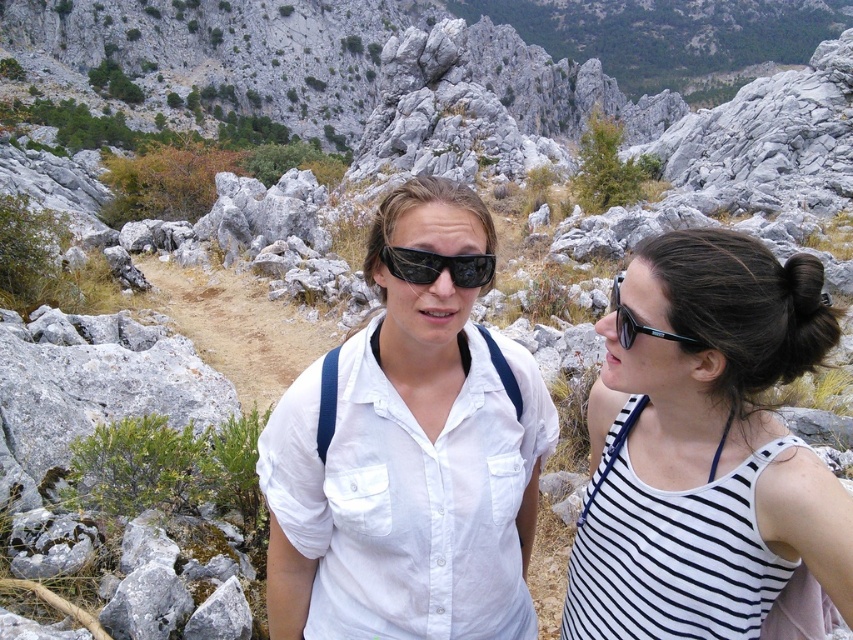
You are a hiker looking for your sunglasses that fell off while climbing. You remember seeing them near two other pairs in the rocky terrain. According to the scene, which pair of black plastic sunglasses is higher up between the black plastic sunglasses at center and the black plastic sunglasses at right?

The black plastic sunglasses at center is located above the black plastic sunglasses at right, so the higher pair is the black plastic sunglasses at center.

You are a hiker trying to determine which clothing item is more likely to be visible from a distance. Based on their sizes, which one would stand out more? Please refer to the white cotton shirt at center and the white striped tank top at right.

The white striped tank top at right is larger in size compared to the white cotton shirt at center, so it would be more visible from a distance.

Looking at this image, you are a photographer trying to capture a photo of the two people in the mountainous landscape. You notice the white cotton shirt at center and the black plastic sunglasses at right. Which object is shorter in height?

The white cotton shirt at center is shorter in height compared to the black plastic sunglasses at right.